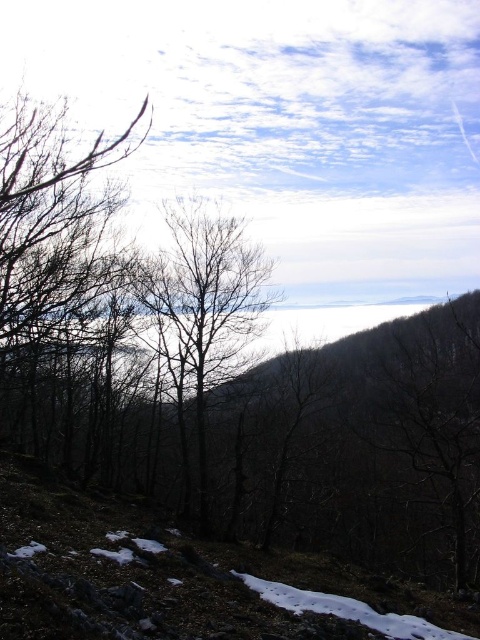
Question: Which point appears farthest from the camera in this image?

Choices:
 (A) (64, 129)
 (B) (207, 388)

Answer: (B)

Question: Does bare branches at left appear on the left side of brown/dry wood tree at center?

Choices:
 (A) yes
 (B) no

Answer: (A)

Question: Is bare branches at left smaller than brown/dry wood tree at center?

Choices:
 (A) yes
 (B) no

Answer: (A)

Question: Which object appears closest to the camera in this image?

Choices:
 (A) brown/dry wood tree at center
 (B) bare branches at left

Answer: (B)

Question: Which point is farther to the camera?

Choices:
 (A) brown/dry wood tree at center
 (B) bare branches at left

Answer: (A)

Question: Is bare branches at left positioned in front of brown/dry wood tree at center?

Choices:
 (A) yes
 (B) no

Answer: (A)